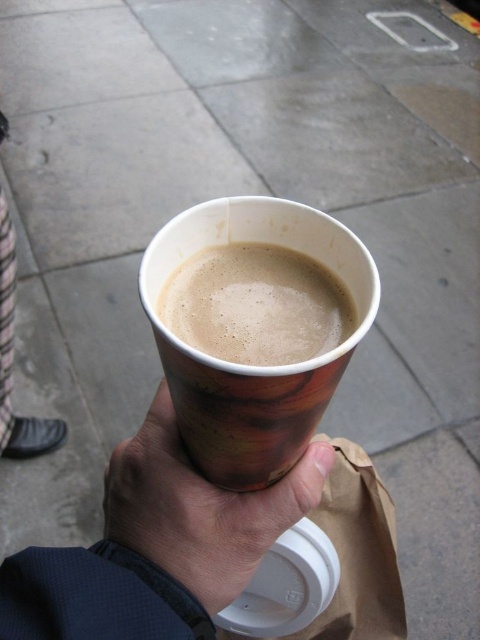
Question: Which point is farther to the camera?

Choices:
 (A) (254, 243)
 (B) (340, 464)
 (C) (129, 460)

Answer: (B)

Question: Can you confirm if brown paper cup at center is wider than brown paper bag at lower center?

Choices:
 (A) yes
 (B) no

Answer: (B)

Question: Which point is closer to the camera taking this photo?

Choices:
 (A) (217, 545)
 (B) (331, 621)

Answer: (A)

Question: Does brown paper cup at center have a larger size compared to brown paper bag at lower center?

Choices:
 (A) yes
 (B) no

Answer: (B)

Question: Which point is closer to the camera taking this photo?

Choices:
 (A) (251, 348)
 (B) (374, 499)

Answer: (A)

Question: Is wooden-patterned cup at center positioned at the back of brown paper cup at center?

Choices:
 (A) yes
 (B) no

Answer: (B)